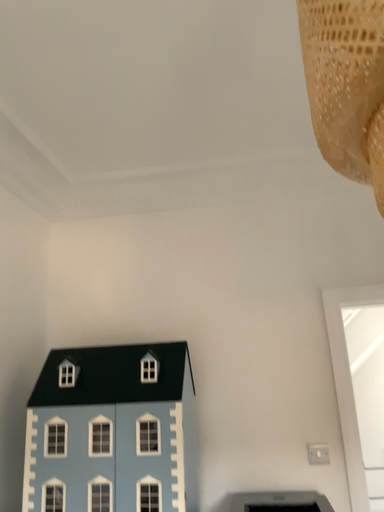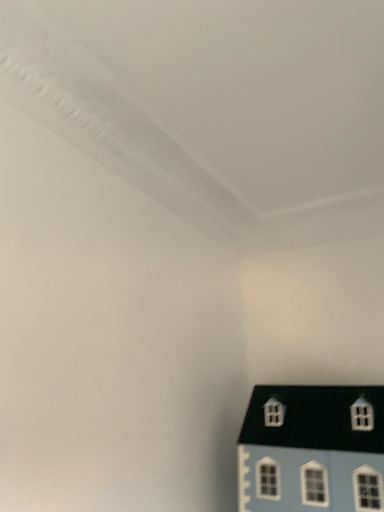
Question: Which way did the camera rotate in the video?

Choices:
 (A) rotated left
 (B) rotated right

Answer: (A)